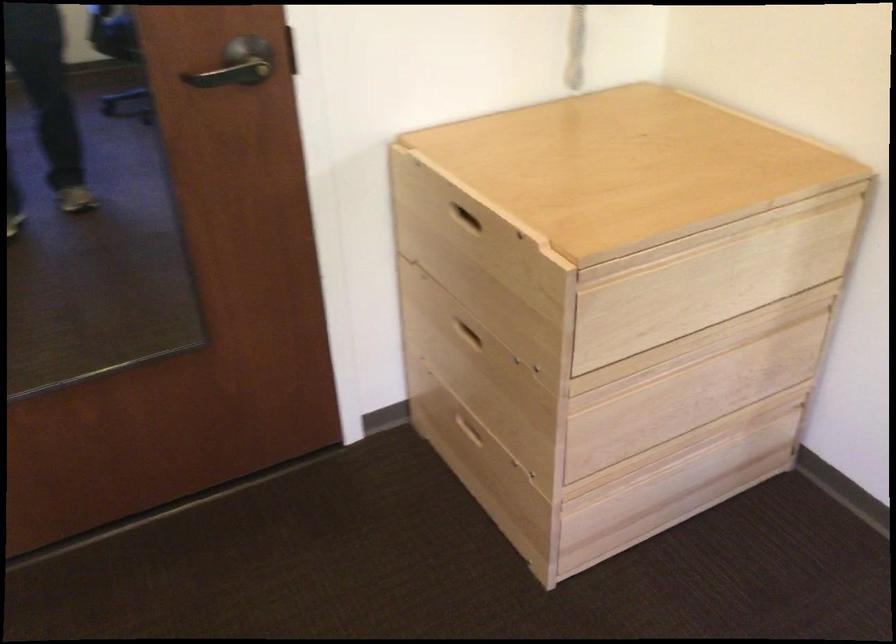
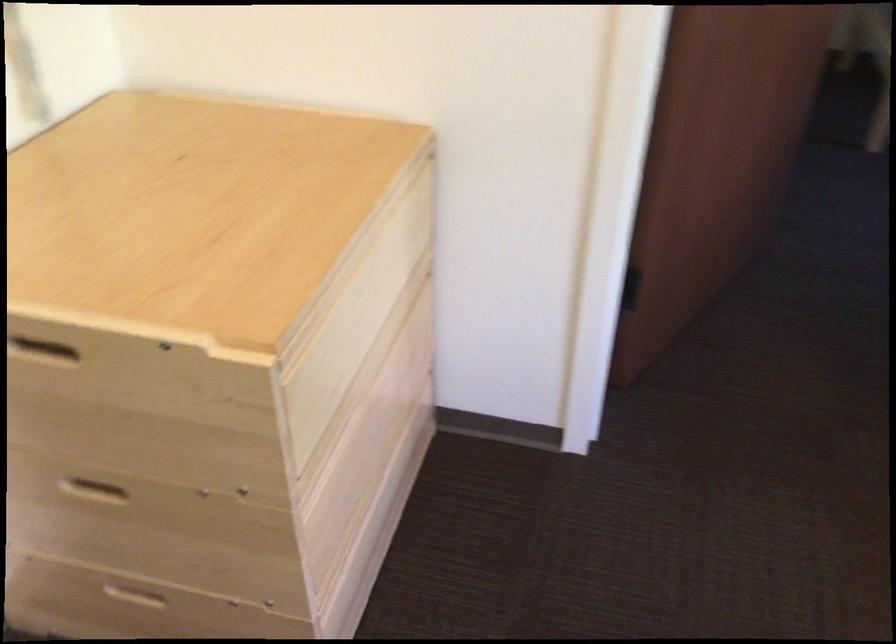
Question: Based on the continuous images, in which direction is the camera rotating? Reply with the corresponding letter.

Choices:
 (A) Left
 (B) Right
 (C) Up
 (D) Down

Answer: (B)